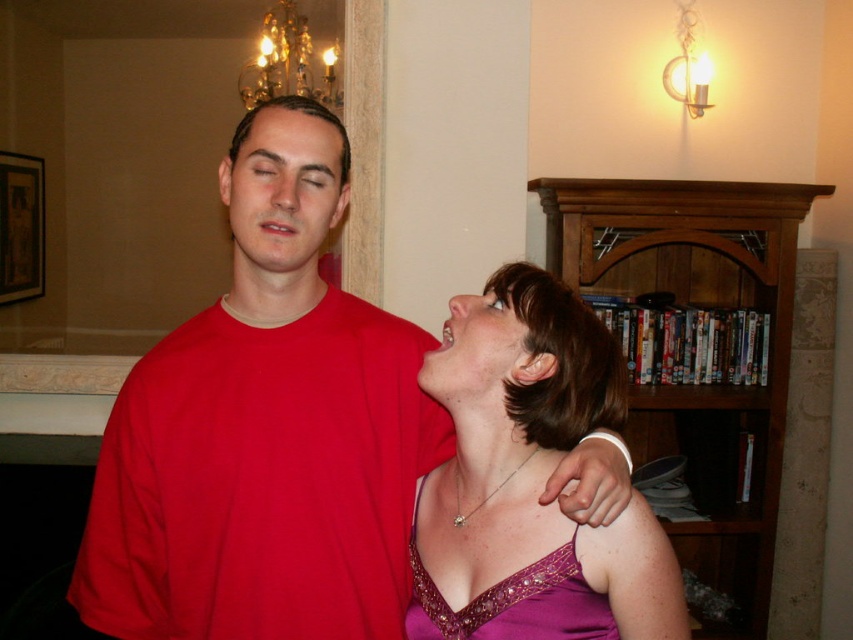
You are standing in the room and want to place a small decorative item between the two points, point (650, 340) and point (558, 618). Which point should the item be closer to in order to be closer to the viewer?

The item should be closer to point (650, 340) because it is closer to the viewer than point (558, 618).